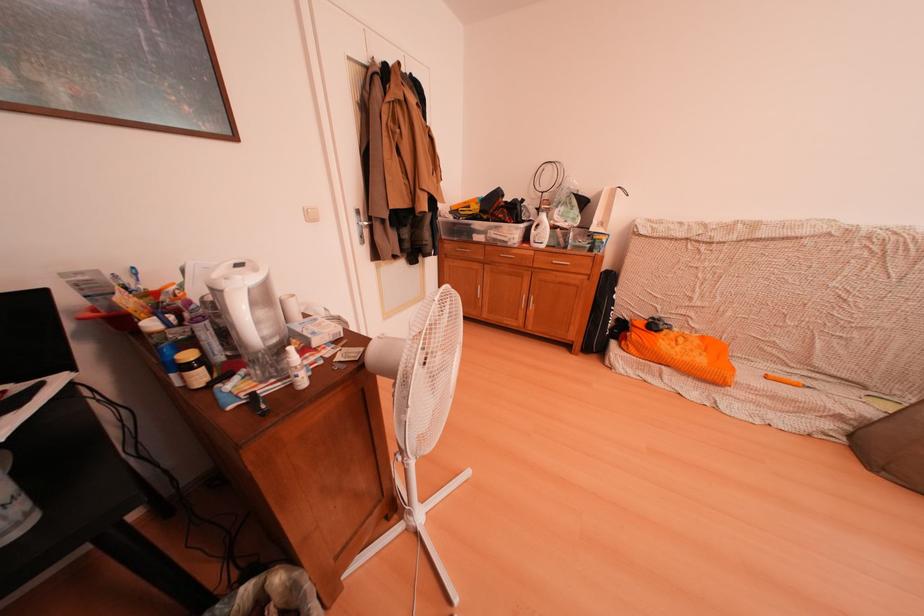
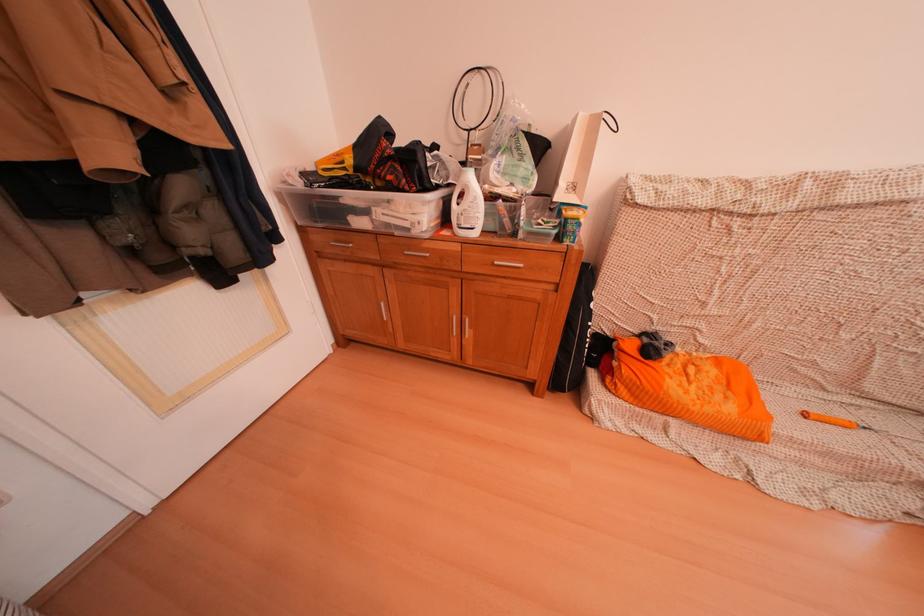
Question: The images are taken continuously from a first-person perspective. In which direction is your viewpoint rotating?

Choices:
 (A) Left
 (B) Right
 (C) Up
 (D) Down

Answer: (B)